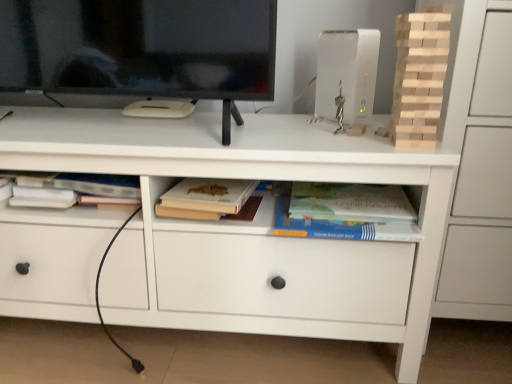
Question: From a real-world perspective, relative to natural wood tower at upper right, is hardcover book at center, arranged as the 1th paperback book when viewed from the right, vertically above or below?

Choices:
 (A) below
 (B) above

Answer: (A)

Question: Would you say hardcover book at center, arranged as the 1th paperback book when viewed from the right, is to the left or to the right of natural wood tower at upper right in the picture?

Choices:
 (A) right
 (B) left

Answer: (B)

Question: Estimate the real-world distances between objects in this image. Which object is farther from the matte beige book at center, marked as the 2th paperback book in a right-to-left arrangement?

Choices:
 (A) white plastic router at upper right
 (B) natural wood tower at upper right
 (C) hardcover book at center, arranged as the 1th paperback book when viewed from the right
 (D) white matte chest of drawers at center

Answer: (B)

Question: Which object is the closest to the matte beige book at center, which ranks as the first paperback book in left-to-right order?

Choices:
 (A) white plastic router at upper right
 (B) white matte chest of drawers at center
 (C) hardcover book at center, arranged as the 1th paperback book when viewed from the right
 (D) natural wood tower at upper right

Answer: (B)